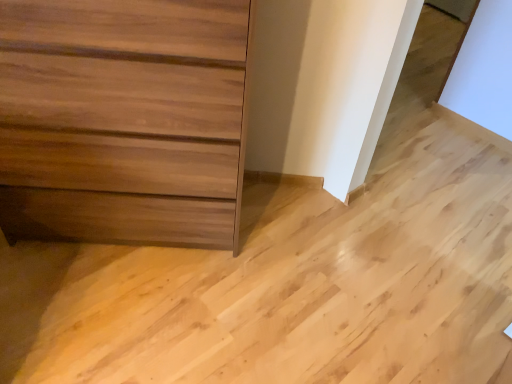
What is the approximate width of matte wood chest of drawers at left?

matte wood chest of drawers at left is 18.64 inches in width.

Locate an element on the screen. The image size is (512, 384). matte wood chest of drawers at left is located at coordinates (123, 120).

This screenshot has width=512, height=384. What do you see at coordinates (123, 120) in the screenshot?
I see `matte wood chest of drawers at left` at bounding box center [123, 120].

The height and width of the screenshot is (384, 512). Find the location of `matte wood chest of drawers at left`. matte wood chest of drawers at left is located at coordinates (123, 120).